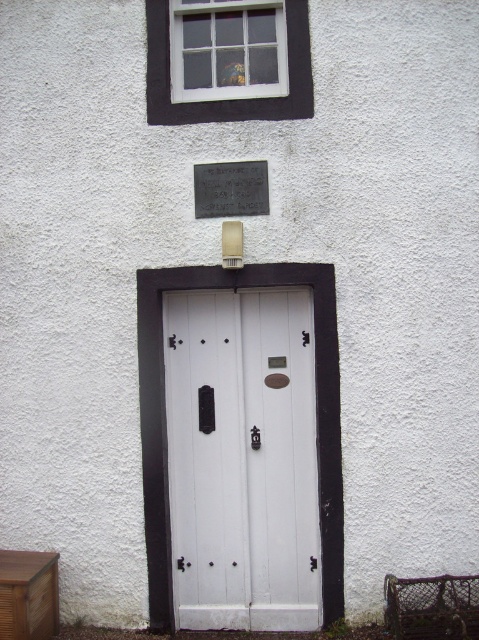
What is the spatial relationship between the white wooden window at upper center and the wooden drawer at lower left?

The white wooden window at upper center is located to the right of the wooden drawer at lower left.